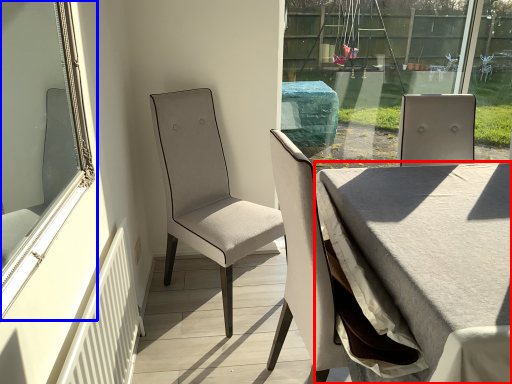
Question: Which object appears closest to the camera in this image, table (highlighted by a red box) or window (highlighted by a blue box)?

Choices:
 (A) table
 (B) window

Answer: (B)